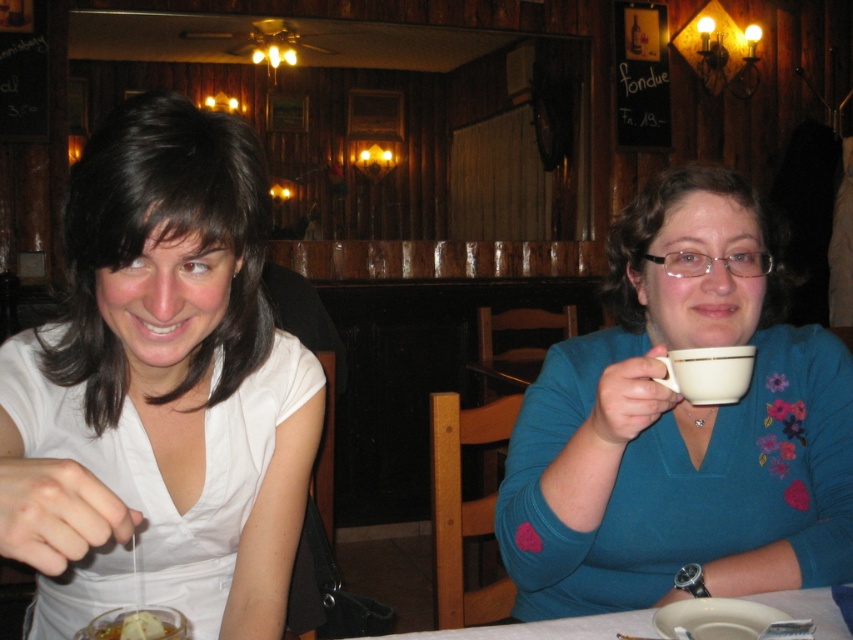
You are a customer in the restaurant and want to place your phone on the table. Which object should you place it on, the white matte shirt at left or the white glossy table at lower center?

You should place your phone on the white glossy table at lower center because it is a table surface, while the white matte shirt at left is clothing and not suitable for placing items.

Looking at this image, you are a photographer trying to capture a portrait of both the white matte shirt at left and the teal jersey at upper right. Since you want both subjects to be centered in the frame, which direction should you move your camera to ensure both are visible?

Since the white matte shirt at left is to the left of the teal jersey at upper right, you should move the camera to the left to center both subjects in the frame.

You are a photographer standing at the center of the scene. You want to capture a closeup shot of the teal jersey at upper right located at point (x=680, y=422). However, your camera can only focus on objects within a 0.2 radius from your current position. Can you take the photo without moving?

The point (x=680, y=422) is outside the 0.2 radius from the center, so you cannot take the photo without moving closer.